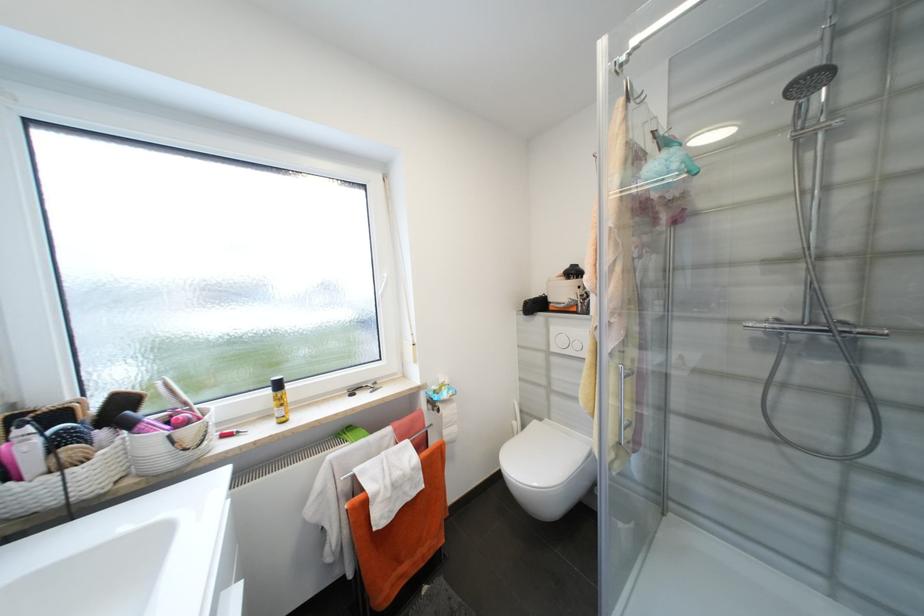
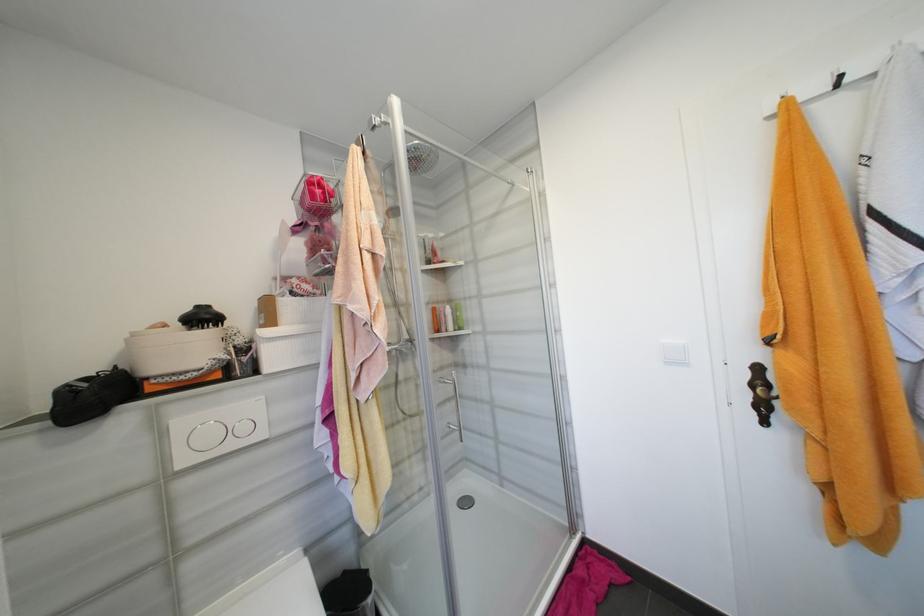
Where in the second image is the point corresponding to [560,350] from the first image?

(189, 463)